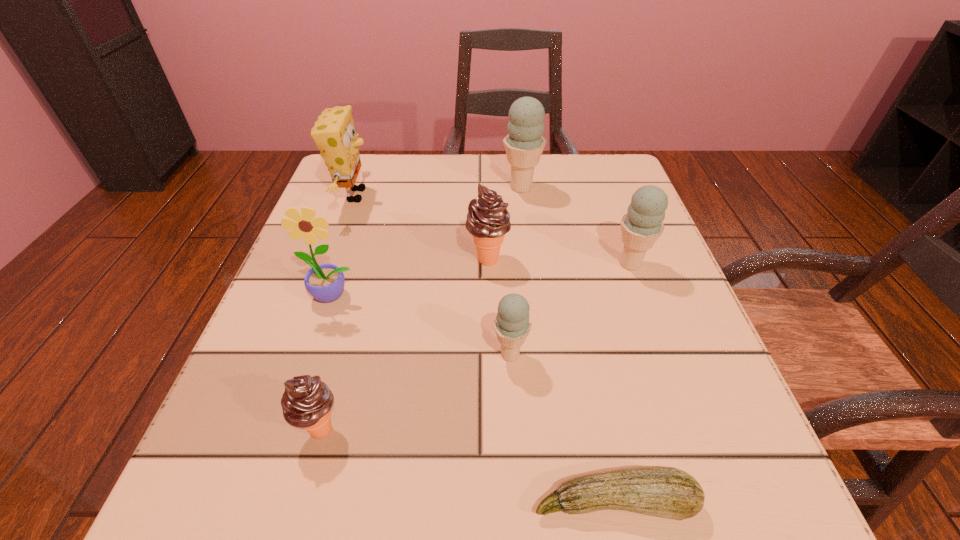
Where is `the tallest icecream`? The height and width of the screenshot is (540, 960). the tallest icecream is located at coordinates (524, 144).

The height and width of the screenshot is (540, 960). Identify the location of the farthest icecream. (524, 144).

Identify the location of sunflower. (325, 282).

This screenshot has height=540, width=960. In order to click on yellow sponge in this screenshot , I will do `click(335, 136)`.

This screenshot has height=540, width=960. Find the location of `the right chocolate icecream`. the right chocolate icecream is located at coordinates (488, 220).

This screenshot has width=960, height=540. I want to click on the farther chocolate icecream, so click(488, 220).

Find the location of `the second biggest blue ice cream`. the second biggest blue ice cream is located at coordinates (642, 225).

Locate an element on the screen. This screenshot has width=960, height=540. the rightmost blue ice cream is located at coordinates (642, 225).

The image size is (960, 540). In order to click on the sixth farthest object in this screenshot , I will do `click(512, 325)`.

Find the location of `the second nearest icecream`. the second nearest icecream is located at coordinates (512, 325).